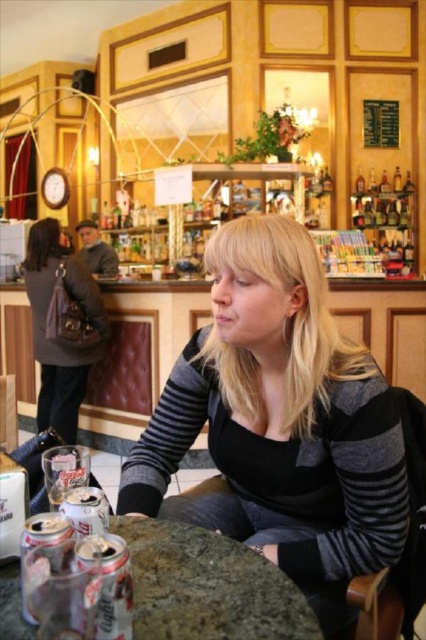
You are a customer entering the cozy cafe and see the striped sweater at center and the dark gray wool coat at left. Which item is nearer to you as you stand at the entrance?

The striped sweater at center is closer to the viewer than the dark gray wool coat at left, so the striped sweater at center is nearer to you as you stand at the entrance.

In the scene shown: You are a customer who wants to place a small bag on the floor between the striped sweater at center and the dark gray wool coat at left. Can you estimate if there is enough space between them for the bag?

The striped sweater at center might be wider than dark gray wool coat at left, so there may not be enough space between them for the bag. Please check the actual distance before placing the bag.

You are a customer who wants to place a large plate of food on the granite table at center. The plate is 30 cm in diameter. Can the striped sweater at center be moved to make space?

The striped sweater at center might be wider than the granite table at center, so moving it could be necessary to ensure there is enough space for the 30 cm plate. However, since the sweater is possibly wider than the table, it might already occupy most of the surface area. To be safe, you should check the exact dimensions before deciding.